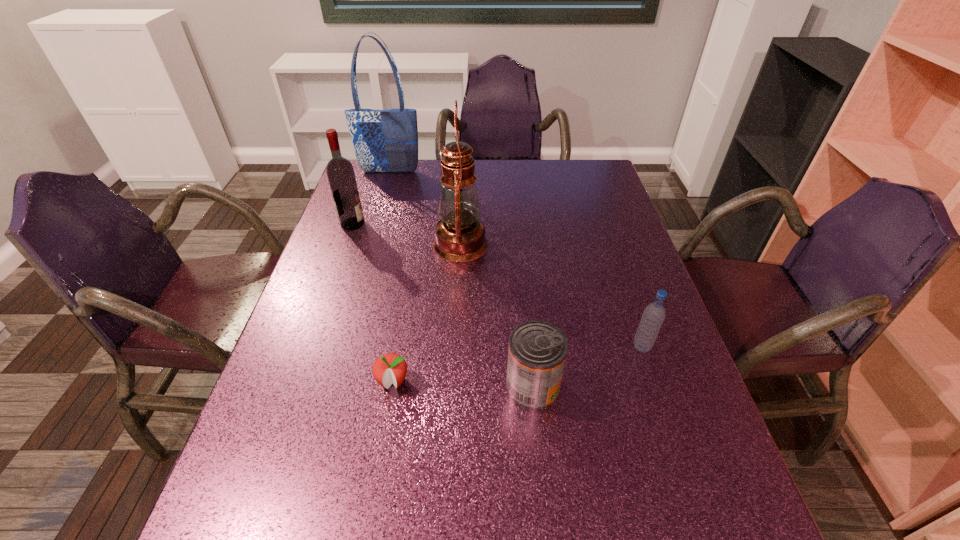
The height and width of the screenshot is (540, 960). I want to click on vacant area at the left edge, so click(371, 202).

This screenshot has width=960, height=540. In the image, there is a desktop. Identify the location of free space at the right edge. (587, 235).

Where is `vacant area at the far right corner of the desktop`? The height and width of the screenshot is (540, 960). vacant area at the far right corner of the desktop is located at coordinates (593, 163).

Identify the location of vacant area that lies between the water bottle and the oil lamp. (551, 295).

Locate an element on the screen. Image resolution: width=960 pixels, height=540 pixels. free spot between the third nearest object and the oil lamp is located at coordinates (551, 295).

Identify the location of free spot between the rightmost object and the shopping bag. (516, 260).

Locate an element on the screen. The image size is (960, 540). free spot between the can and the apple is located at coordinates (463, 384).

Locate an element on the screen. vacant space that's between the shortest object and the fourth object from left to right is located at coordinates (426, 313).

This screenshot has height=540, width=960. Find the location of `free space that is in between the third tallest object and the fourth object from left to right`. free space that is in between the third tallest object and the fourth object from left to right is located at coordinates (406, 234).

Locate an element on the screen. vacant area that lies between the third object from right to left and the shopping bag is located at coordinates (425, 208).